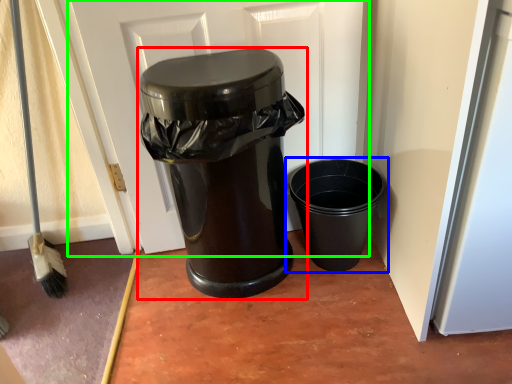
Question: Considering the real-world distances, which object is closest to waste container (highlighted by a red box)? waste container (highlighted by a blue box) or screen door (highlighted by a green box).

Choices:
 (A) waste container
 (B) screen door

Answer: (B)